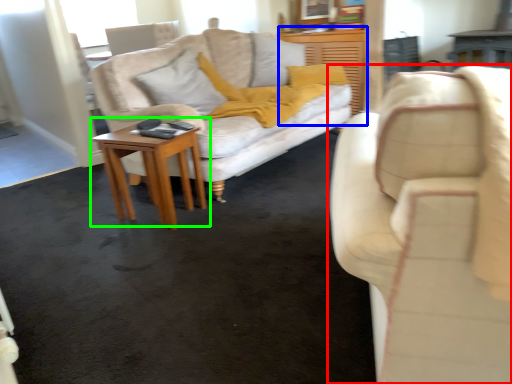
Question: Which object is the closest to the studio couch (highlighted by a red box)? Choose among these: dresser (highlighted by a blue box) or table (highlighted by a green box).

Choices:
 (A) dresser
 (B) table

Answer: (B)